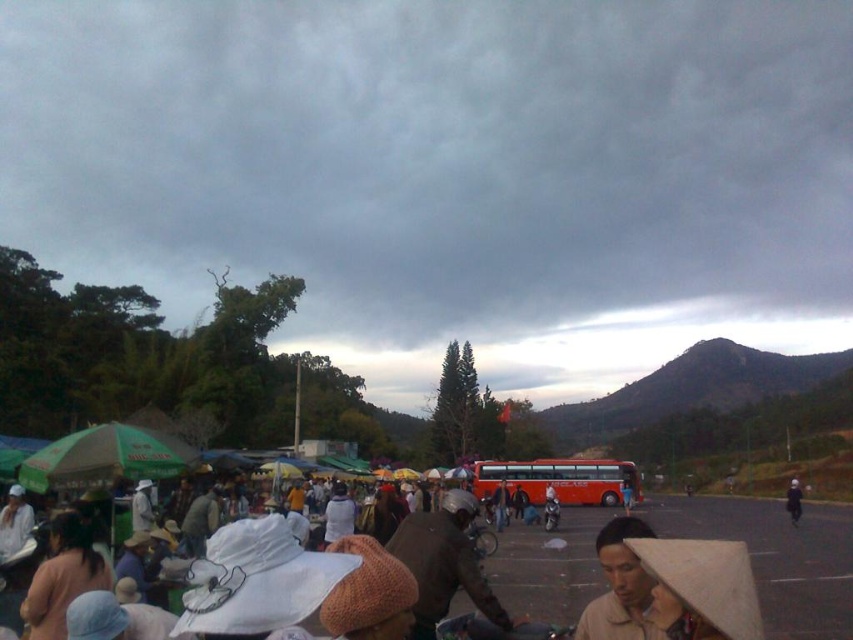
You are a photographer standing in the market and want to capture both the brown fabric hat at center and the orange matte bus at center in a single photo. Based on their positions, which object should you adjust your camera angle to focus on first to ensure both are in frame?

The brown fabric hat at center is located above the orange matte bus at center, so you should adjust your camera angle to focus on the brown fabric hat at center first to ensure both are in frame.

You are a photographer trying to capture the brown fabric hat at center and the metallic silver motorcycle at center in the same frame. Based on their positions, which object is higher up in the image?

The brown fabric hat at center is above the metallic silver motorcycle at center, so it is higher up in the image.